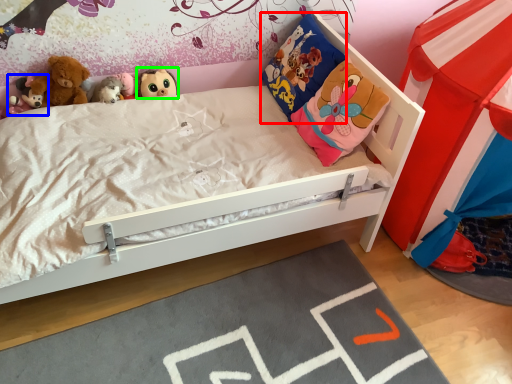
Question: Which is farther away from pillow (highlighted by a red box)? toy (highlighted by a blue box) or toy (highlighted by a green box)?

Choices:
 (A) toy
 (B) toy

Answer: (A)